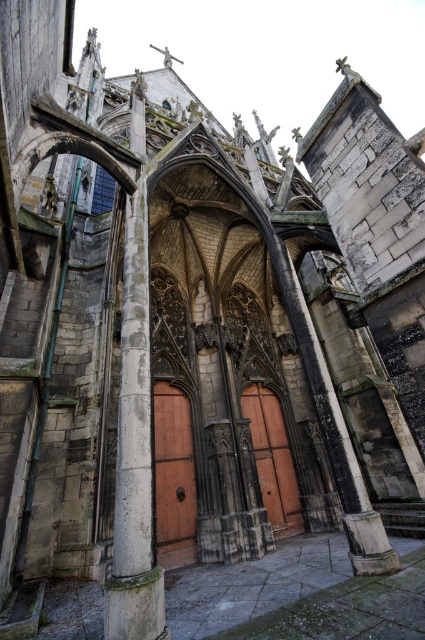
Who is more distant from viewer, (119, 435) or (190, 484)?

The point (190, 484) is behind.

Which of these two, stone column at center or wooden door at center, stands shorter?

Standing shorter between the two is wooden door at center.

Does point (147, 284) come closer to viewer compared to point (175, 456)?

Yes, it is in front of point (175, 456).

Locate an element on the screen. This screenshot has width=425, height=640. stone column at center is located at coordinates (135, 451).

Consider the image. Can you confirm if wooden door at center is smaller than brown wooden door at center?

No, wooden door at center is not smaller than brown wooden door at center.

Who is taller, wooden door at center or brown wooden door at center?

With more height is wooden door at center.

Identify the location of wooden door at center. The height and width of the screenshot is (640, 425). (173, 477).

Describe the element at coordinates (135, 451) in the screenshot. The image size is (425, 640). I see `stone column at center` at that location.

Between stone column at center and brown wooden door at center, which one appears on the left side from the viewer's perspective?

stone column at center

Who is more forward, (122, 632) or (274, 486)?

Positioned in front is point (122, 632).

This screenshot has height=640, width=425. In order to click on stone column at center in this screenshot , I will do `click(135, 451)`.